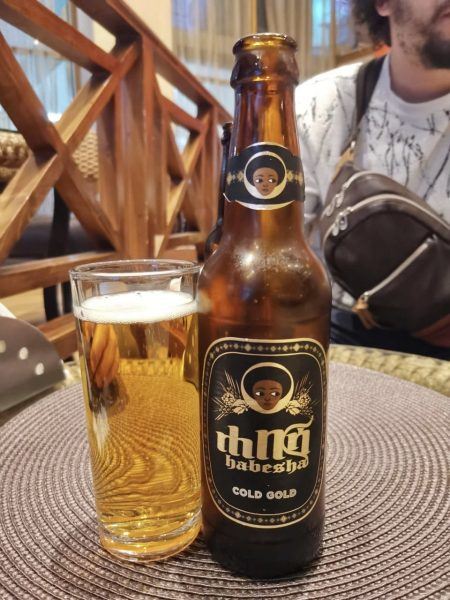
What are the coordinates of `napkin holder` in the screenshot? It's located at (21, 365).